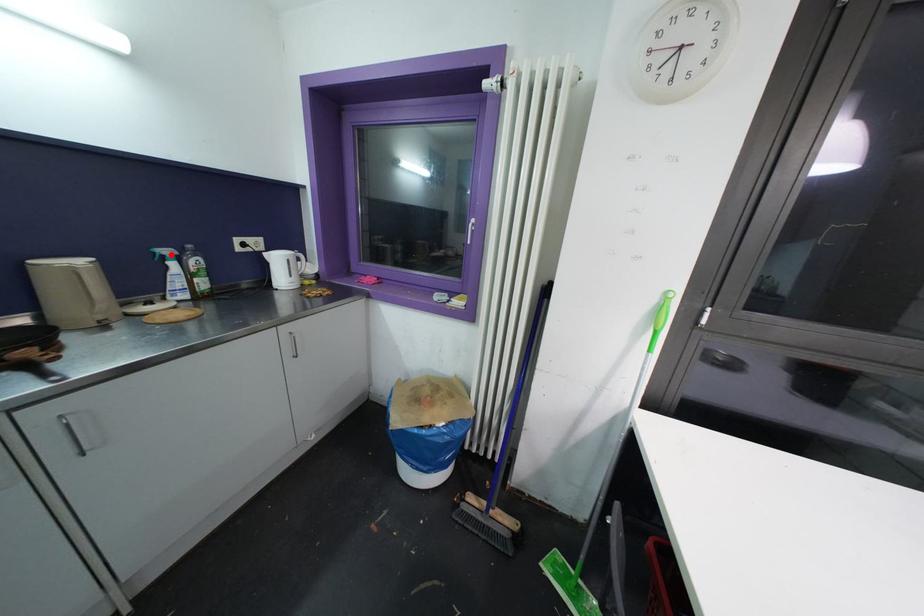
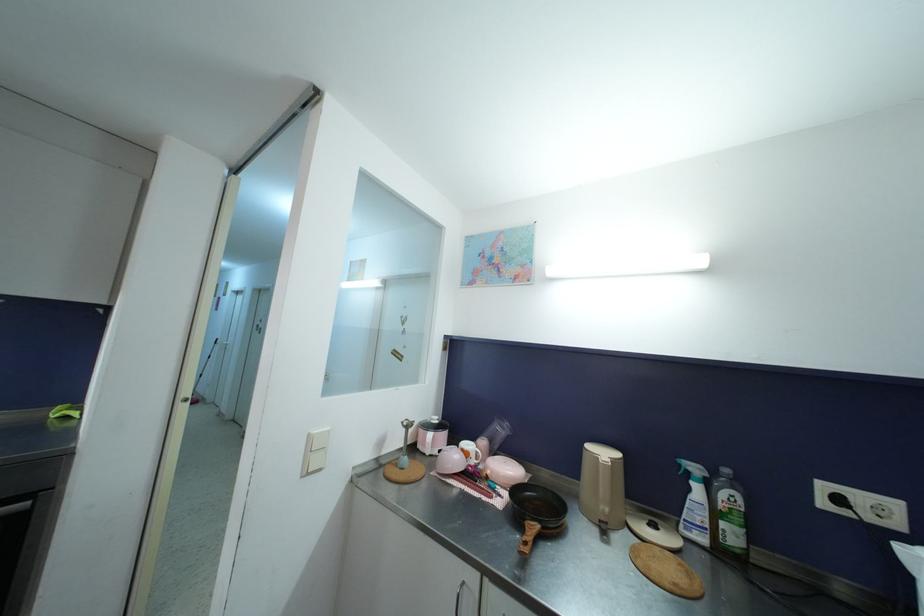
The point at the highlighted location is marked in the first image. Where is the corresponding point in the second image?

(699, 472)